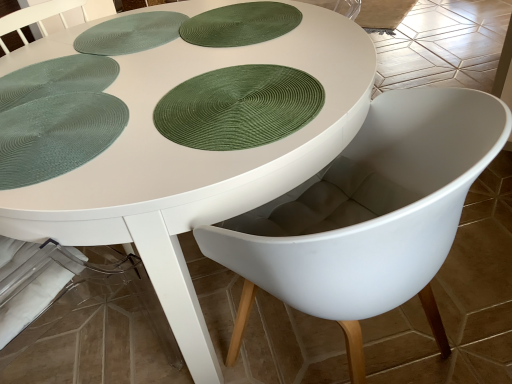
Where is `free space that is in between green textured placemat at upper center, the 1th paper plate viewed from the top, and green textured placemat at upper left`? Image resolution: width=512 pixels, height=384 pixels. free space that is in between green textured placemat at upper center, the 1th paper plate viewed from the top, and green textured placemat at upper left is located at coordinates (164, 53).